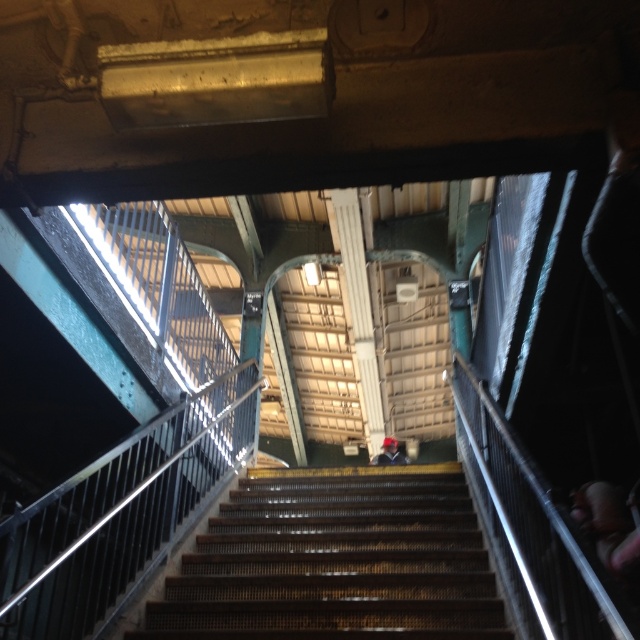
Question: Which of the following is the farthest from the observer?

Choices:
 (A) dark blue fabric jacket at center
 (B) metallic brown stairs at center

Answer: (A)

Question: Does metallic brown stairs at center have a lesser width compared to dark blue fabric jacket at center?

Choices:
 (A) no
 (B) yes

Answer: (A)

Question: Does metallic brown stairs at center have a smaller size compared to dark blue fabric jacket at center?

Choices:
 (A) yes
 (B) no

Answer: (B)

Question: Does metallic brown stairs at center have a greater width compared to dark blue fabric jacket at center?

Choices:
 (A) no
 (B) yes

Answer: (B)